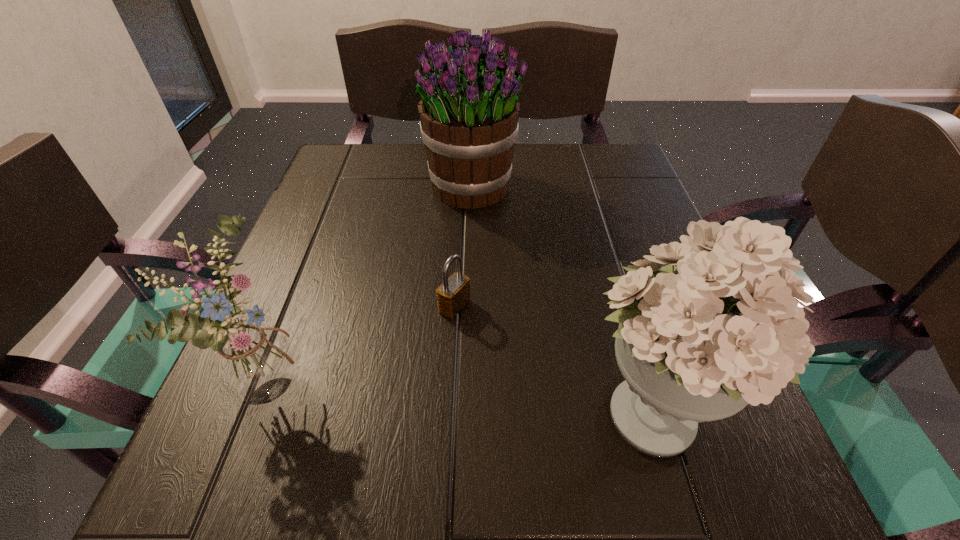
Identify the location of vacant area between the rightmost object and the padlock. (553, 357).

Identify the location of unoccupied position between the rightmost bouquet and the leftmost object. (463, 394).

Locate an element on the screen. This screenshot has height=540, width=960. free space between the second bouquet from left to right and the leftmost bouquet is located at coordinates (373, 284).

This screenshot has width=960, height=540. Identify the location of the second closest object to the padlock. (254, 366).

At what (x,y) coordinates should I click in order to perform the action: click on object that is the second closest to the rightmost object. Please return your answer as a coordinate pair (x, y). The height and width of the screenshot is (540, 960). Looking at the image, I should click on (469, 111).

Identify which bouquet is the closest to the rightmost object. Please provide its 2D coordinates. Your answer should be formatted as a tuple, i.e. [(x, y)], where the tuple contains the x and y coordinates of a point satisfying the conditions above.

[(469, 111)]

Where is `bouquet that stands as the second closest to the farthest object`? The width and height of the screenshot is (960, 540). bouquet that stands as the second closest to the farthest object is located at coordinates click(727, 331).

You are a GUI agent. You are given a task and a screenshot of the screen. Output one action in this format:
    pyautogui.click(x=<x>, y=<y>)
    Task: Click on the vacant space that satisfies the following two spatial constraints: 1. on the back side of the rightmost bouquet; 2. on the front-facing side of the second shortest object
    Image resolution: width=960 pixels, height=540 pixels.
    Given the screenshot: What is the action you would take?
    pyautogui.click(x=642, y=380)

Where is `free location that satisfies the following two spatial constraints: 1. on the front side of the rightmost bouquet; 2. on the right side of the third nearest object`? This screenshot has height=540, width=960. free location that satisfies the following two spatial constraints: 1. on the front side of the rightmost bouquet; 2. on the right side of the third nearest object is located at coordinates click(x=449, y=409).

Image resolution: width=960 pixels, height=540 pixels. Find the location of `vacant space that satisfies the following two spatial constraints: 1. on the front-facing side of the rightmost bouquet; 2. on the left side of the third tallest object`. vacant space that satisfies the following two spatial constraints: 1. on the front-facing side of the rightmost bouquet; 2. on the left side of the third tallest object is located at coordinates (263, 409).